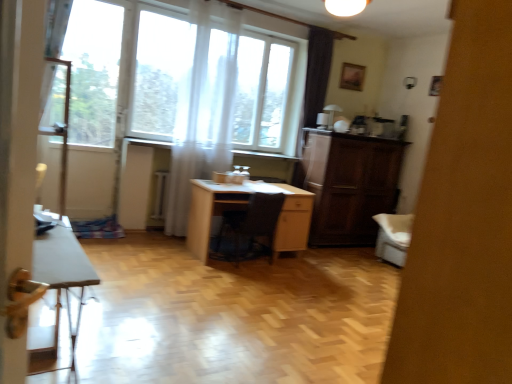
In order to face dark wood cabinet at right, should I rotate leftwards or rightwards?

It's best to rotate right around 12.643 degrees.

What do you see at coordinates (202, 121) in the screenshot?
I see `white sheer curtain at upper center` at bounding box center [202, 121].

Locate an element on the screen. Image resolution: width=512 pixels, height=384 pixels. white glossy table at lower left is located at coordinates (63, 275).

Where is `black leather chair at center`? black leather chair at center is located at coordinates (250, 226).

You are a GUI agent. You are given a task and a screenshot of the screen. Output one action in this format:
    pyautogui.click(x=<x>, y=<y>)
    Task: Click on the dark wood cabinet at right
    Image resolution: width=512 pixels, height=384 pixels.
    Given the screenshot: What is the action you would take?
    pyautogui.click(x=349, y=184)

Is white glossy cabinet at right looking in the opposite direction of white sheer curtain at upper center?

white glossy cabinet at right is not turned away from white sheer curtain at upper center.

Which of these two, white glossy cabinet at right or white sheer curtain at upper center, is thinner?

white sheer curtain at upper center.

Are white glossy cabinet at right and white sheer curtain at upper center far apart?

Yes, white glossy cabinet at right and white sheer curtain at upper center are located far from each other.

Which of these two, white sheer curtain at upper center or white glossy cabinet at right, is wider?

white glossy cabinet at right.

Is white sheer curtain at upper center oriented away from white glossy cabinet at right?

white sheer curtain at upper center does not have its back to white glossy cabinet at right.

Find the location of a particular element. The height and width of the screenshot is (384, 512). curtain above the white glossy cabinet at right (from the image's perspective) is located at coordinates (202, 121).

From their relative heights in the image, would you say white sheer curtain at upper center is taller or shorter than white glossy cabinet at right?

white sheer curtain at upper center is taller than white glossy cabinet at right.

What are the coordinates of `curtain in front of the dark wood cabinet at right` in the screenshot? It's located at (202, 121).

Looking at this image, which is correct: white sheer curtain at upper center is inside dark wood cabinet at right, or outside of it?

white sheer curtain at upper center is located beyond the bounds of dark wood cabinet at right.

From a real-world perspective, who is located lower, white sheer curtain at upper center or dark wood cabinet at right?

dark wood cabinet at right is physically lower.

Is dark wood cabinet at right far from light wood desk at center?

dark wood cabinet at right is positioned a significant distance from light wood desk at center.

Which of these two, dark wood cabinet at right or light wood desk at center, is smaller?

light wood desk at center.

Does dark wood cabinet at right have a lesser width compared to light wood desk at center?

Correct, the width of dark wood cabinet at right is less than that of light wood desk at center.

Which point is more distant from viewer, (352, 244) or (248, 186)?

The point (352, 244) is farther from the camera.

Is light wood desk at center facing towards white glossy cabinet at right?

Yes, light wood desk at center faces towards white glossy cabinet at right.

From the image's perspective, between light wood desk at center and white glossy cabinet at right, who is located below?

light wood desk at center appears lower in the image.

Is white glossy cabinet at right completely or partially inside light wood desk at center?

Definitely not — white glossy cabinet at right is not inside light wood desk at center.

Can you confirm if white glossy table at lower left is positioned to the right of white sheer curtain at upper center?

Incorrect, white glossy table at lower left is not on the right side of white sheer curtain at upper center.

Is white glossy table at lower left in front of or behind white sheer curtain at upper center in the image?

Clearly, white glossy table at lower left is in front of white sheer curtain at upper center.

How many degrees apart are the facing directions of white glossy table at lower left and white sheer curtain at upper center?

The angle between the facing direction of white glossy table at lower left and the facing direction of white sheer curtain at upper center is 93.4 degrees.

How far apart are white glossy table at lower left and white sheer curtain at upper center?

white glossy table at lower left and white sheer curtain at upper center are 8.62 feet apart.

You are a GUI agent. You are given a task and a screenshot of the screen. Output one action in this format:
    pyautogui.click(x=<x>, y=<y>)
    Task: Click on the chair below the light wood desk at center (from the image's perspective)
    
    Given the screenshot: What is the action you would take?
    pyautogui.click(x=250, y=226)

Which is nearer, (x=264, y=197) or (x=200, y=222)?

Positioned in front is point (x=264, y=197).

Is black leather chair at center to the left of light wood desk at center from the viewer's perspective?

Incorrect, black leather chair at center is not on the left side of light wood desk at center.

Is black leather chair at center wider or thinner than light wood desk at center?

In the image, black leather chair at center appears to be wider than light wood desk at center.

The width and height of the screenshot is (512, 384). What are the coordinates of `screen door beneath the white sheer curtain at upper center (from a real-world perspective)` in the screenshot? It's located at (463, 217).

You are a GUI agent. You are given a task and a screenshot of the screen. Output one action in this format:
    pyautogui.click(x=<x>, y=<y>)
    Task: Click on the curtain that is on the left side of white glossy cabinet at right
    The height and width of the screenshot is (384, 512).
    Given the screenshot: What is the action you would take?
    pyautogui.click(x=202, y=121)

Looking at the image, which one is located further to light wood desk at center, dark wood cabinet at right or black leather chair at center?

dark wood cabinet at right is further to light wood desk at center.

Which object lies nearer to the anchor point black leather chair at center, dark wood cabinet at right or white glossy cabinet at right?

Among the two, dark wood cabinet at right is located nearer to black leather chair at center.

Looking at the image, which one is located closer to light wood desk at center, white glossy table at lower left or white glossy cabinet at right?

Based on the image, white glossy table at lower left appears to be nearer to light wood desk at center.

In the scene shown: From the image, which object appears to be farther from dark wood cabinet at right, white glossy cabinet at right or white glossy table at lower left?

Among the two, white glossy cabinet at right is located further to dark wood cabinet at right.

From the image, which object appears to be farther from black leather chair at center, light wood desk at center or dark wood cabinet at right?

dark wood cabinet at right is further to black leather chair at center.

When comparing their distances from dark wood cabinet at right, does transparent fabric at left or light wood desk at center seem further?

transparent fabric at left is positioned further to the anchor dark wood cabinet at right.

Based on their spatial positions, is dark wood cabinet at right or white glossy cabinet at right further from white glossy table at lower left?

The object further to white glossy table at lower left is dark wood cabinet at right.

Estimate the real-world distances between objects in this image. Which object is closer to dark wood cabinet at right, black leather chair at center or light wood desk at center?

Among the two, light wood desk at center is located nearer to dark wood cabinet at right.

Where is `chair between transparent fabric at left and dark wood cabinet at right from left to right`? chair between transparent fabric at left and dark wood cabinet at right from left to right is located at coordinates (250, 226).

At what (x,y) coordinates should I click in order to perform the action: click on desk between transparent fabric at left and dark wood cabinet at right from left to right. Please return your answer as a coordinate pair (x, y). Image resolution: width=512 pixels, height=384 pixels. Looking at the image, I should click on (244, 209).

Locate an element on the screen. Image resolution: width=512 pixels, height=384 pixels. curtain between transparent fabric at left and light wood desk at center in the horizontal direction is located at coordinates (202, 121).

This screenshot has height=384, width=512. In order to click on desk between white glossy cabinet at right and dark wood cabinet at right along the z-axis in this screenshot , I will do `click(244, 209)`.